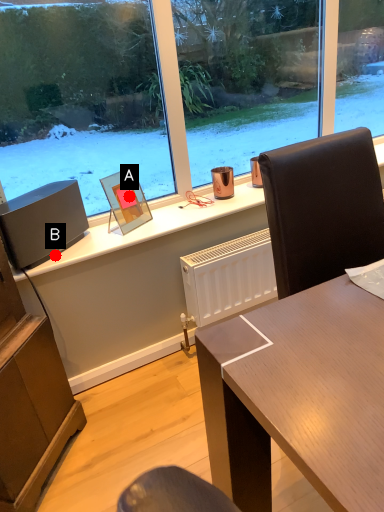
Question: Two points are circled on the image, labeled by A and B beside each circle. Which point is closer to the camera taking this photo?

Choices:
 (A) A is closer
 (B) B is closer

Answer: (B)